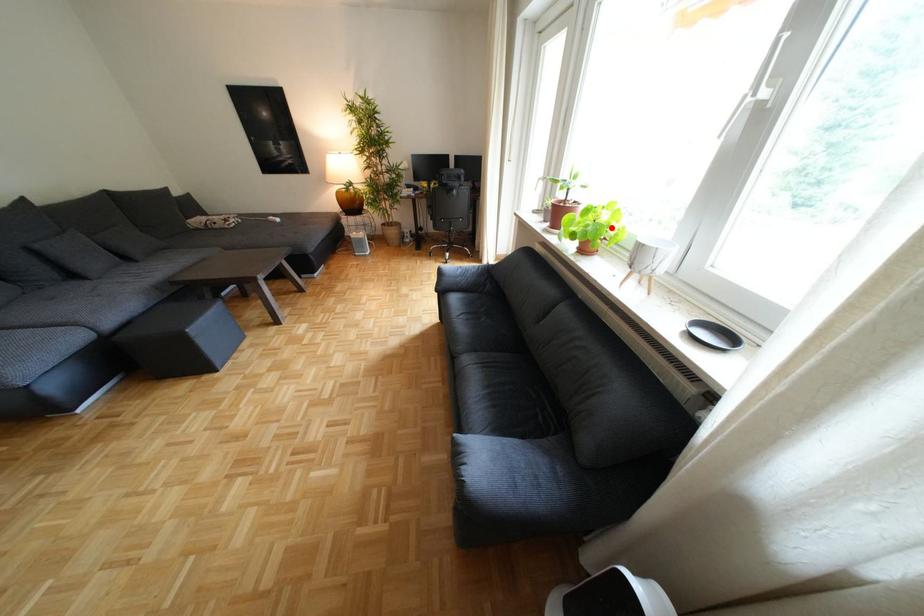
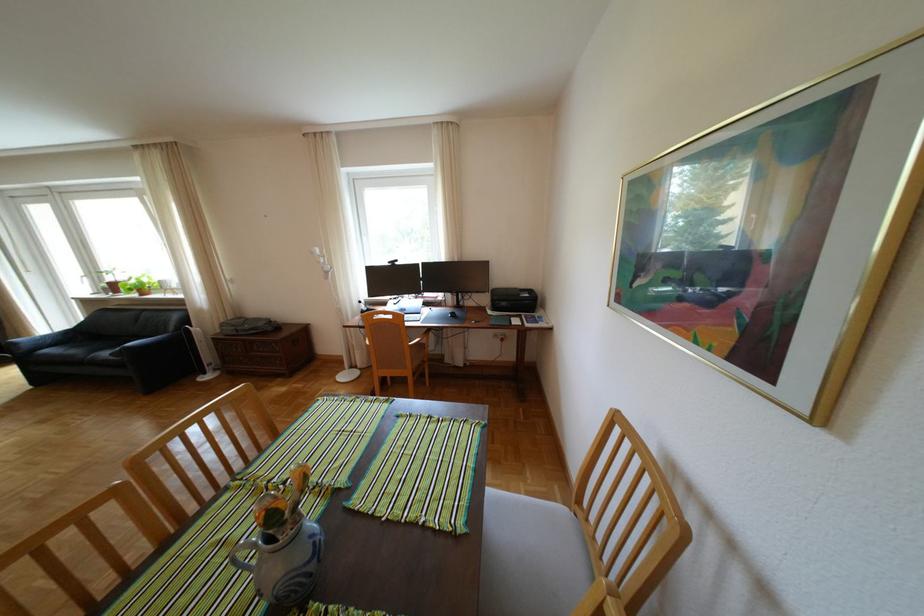
The point at the highlighted location is marked in the first image. Where is the corresponding point in the second image?

(154, 283)